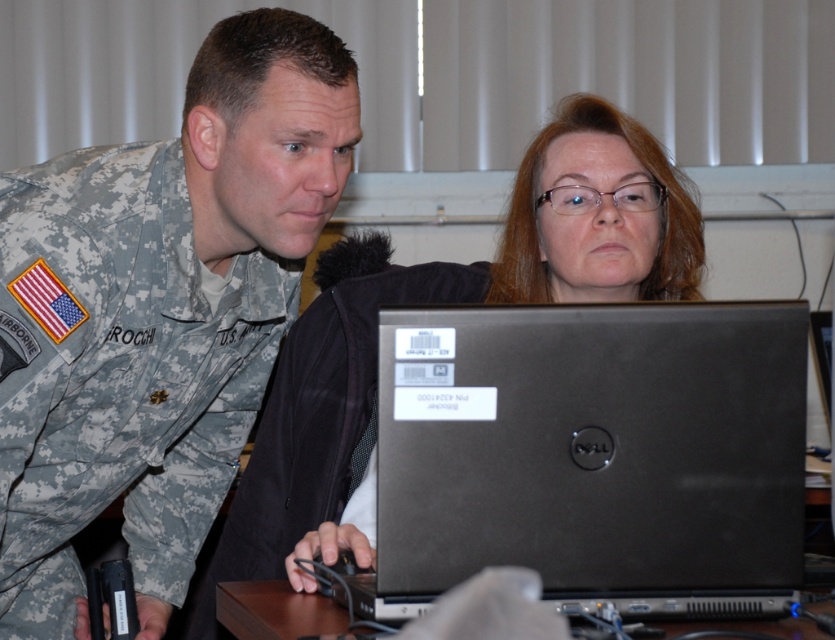
Is camouflage uniform at left thinner than black matte laptop at center?

In fact, camouflage uniform at left might be wider than black matte laptop at center.

Is point (165, 580) positioned behind point (777, 467)?

That is True.

Find the location of `camouflage uniform at left`. camouflage uniform at left is located at coordinates (158, 312).

Can you confirm if black matte laptop at center is positioned below brown wooden table at lower center?

Incorrect, black matte laptop at center is not positioned below brown wooden table at lower center.

Locate an element on the screen. This screenshot has width=835, height=640. black matte laptop at center is located at coordinates (593, 456).

Which of these two, camouflage uniform at left or matte black laptop at center, stands taller?

Standing taller between the two is camouflage uniform at left.

Does camouflage uniform at left appear on the right side of matte black laptop at center?

No, camouflage uniform at left is not to the right of matte black laptop at center.

Identify the location of camouflage uniform at left. This screenshot has height=640, width=835. (158, 312).